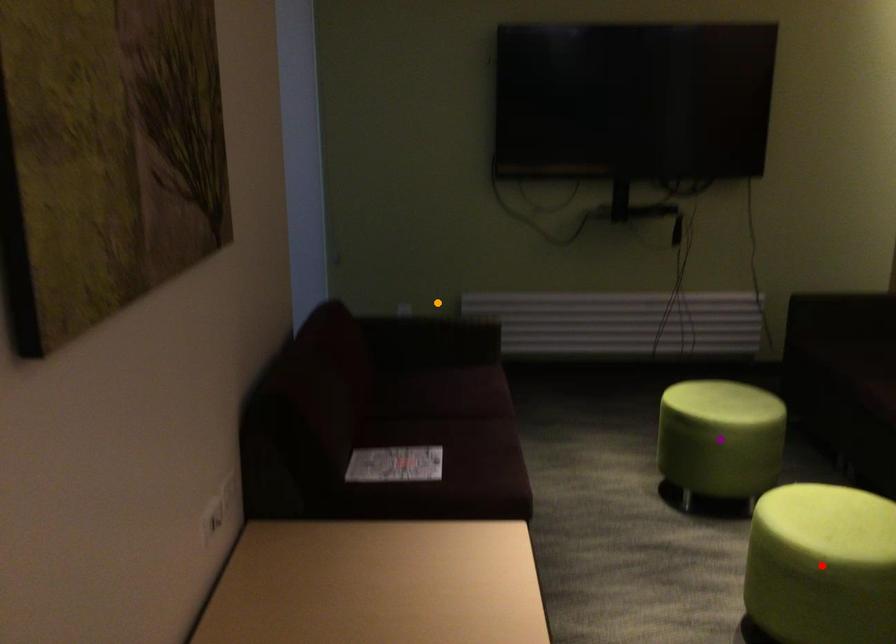
Order these from nearest to farthest:
A) purple point
B) orange point
C) red point

red point → purple point → orange point